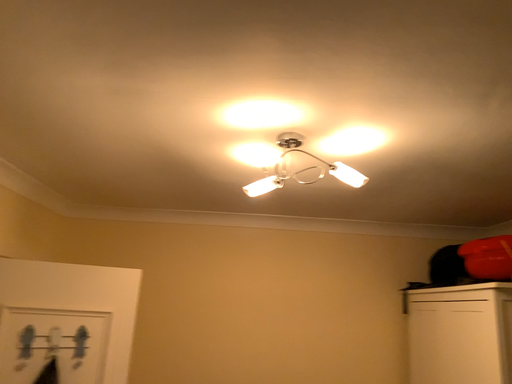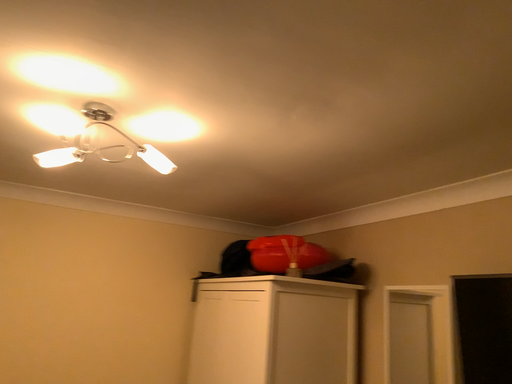
Question: How did the camera likely rotate when shooting the video?

Choices:
 (A) rotated right
 (B) rotated left

Answer: (A)